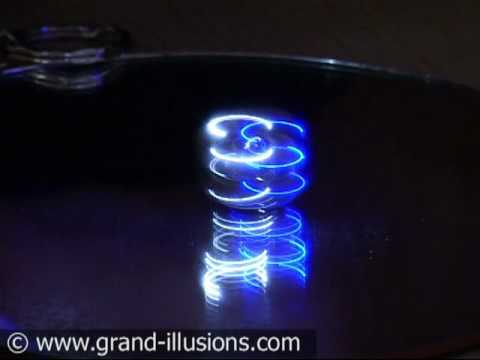
This screenshot has height=360, width=480. I want to click on lights, so click(247, 258).